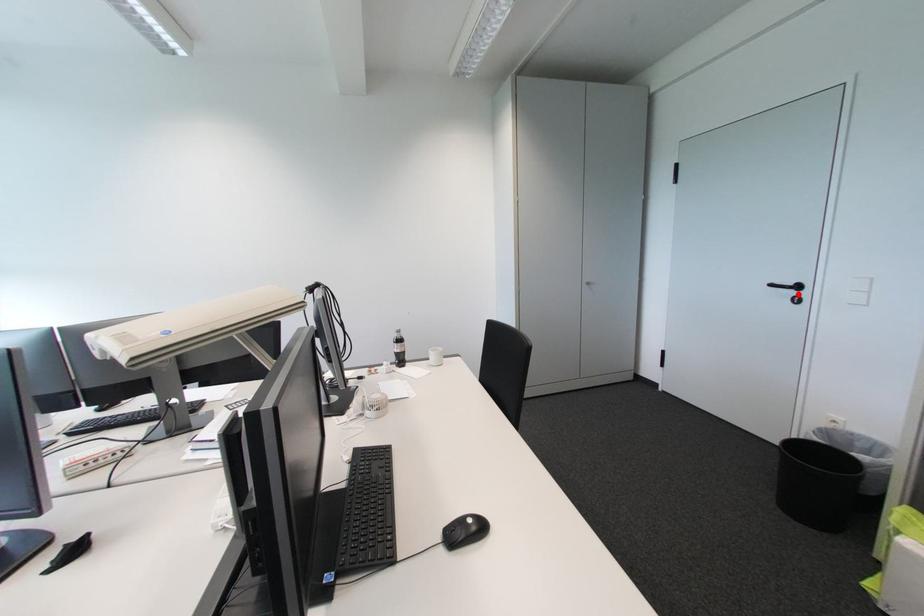
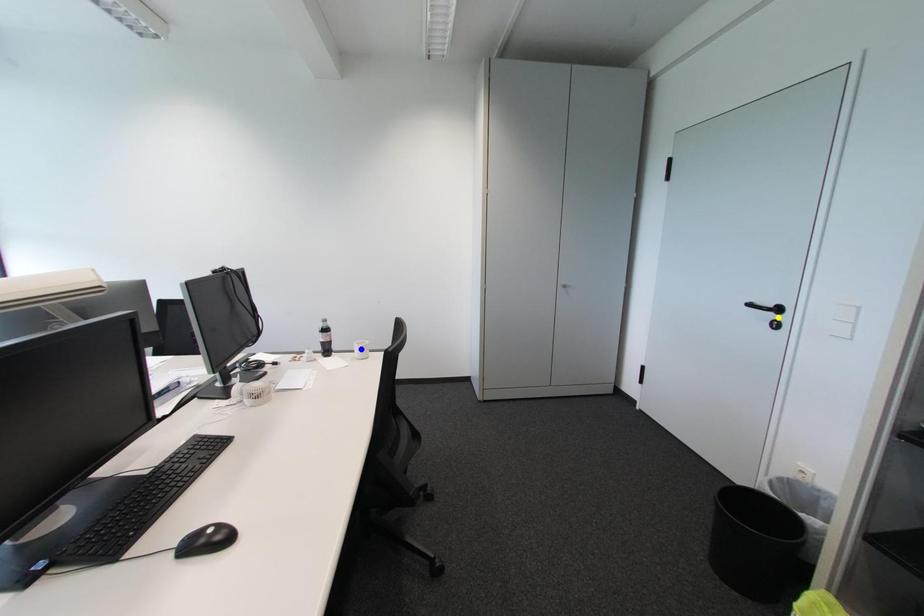
Question: I am providing you with two images of the same scene from different viewpoints. A red point is marked on the first image. You are given multiple points on the second image. Which spot in image 2 lines up with the point in image 1?

Choices:
 (A) green point
 (B) yellow point
 (C) blue point

Answer: (B)